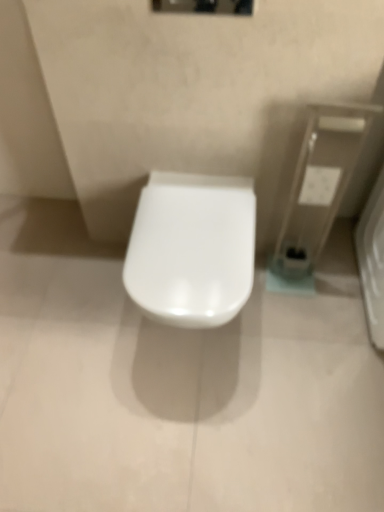
The height and width of the screenshot is (512, 384). I want to click on free space underneath white glossy toilet at center (from a real-world perspective), so click(x=193, y=343).